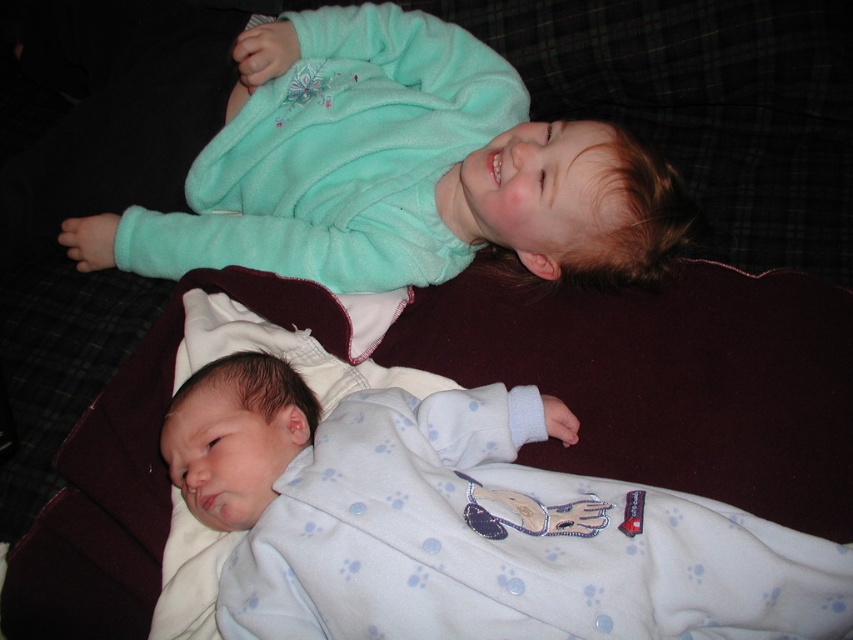
You are a photographer trying to capture a photo of the two children on the couch. You notice the white soft bed at upper center and the teal fleece jacket at upper center. Which object is positioned closer to you?

The white soft bed at upper center is closer to the viewer than the teal fleece jacket at upper center.

You are a photographer standing at the current position. You want to take a photo of the white soft bed at upper center without moving any objects. Can you capture the entire bed in the frame if your camera has a minimum focus distance of 30 inches?

The white soft bed at upper center is 33.40 inches away from the camera. Since the minimum focus distance is 30 inches, the camera can focus on the white soft bed at upper center and capture it in the frame.

You are a photographer standing at the bottom of the image. You want to take a photo of the white soft bed at upper center. Based on its 2D coordinates, where should you point your camera to capture it?

You should point your camera towards the upper center area of the image, specifically at the coordinates point (666, 378), to capture the white soft bed at upper center.